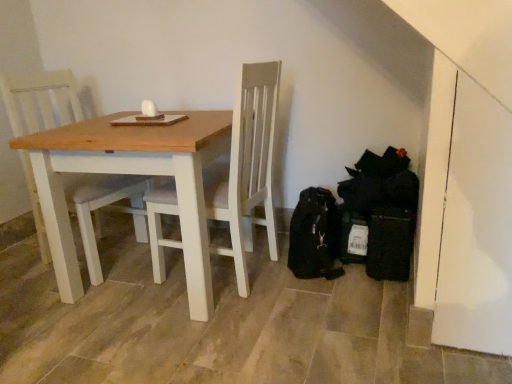
Question: Is wooden table at center located outside white wood chair at center?

Choices:
 (A) no
 (B) yes

Answer: (B)

Question: Is wooden table at center facing away from white wood chair at center?

Choices:
 (A) yes
 (B) no

Answer: (A)

Question: Does wooden table at center have a lesser height compared to white wood chair at center?

Choices:
 (A) yes
 (B) no

Answer: (A)

Question: Is wooden table at center far from white wood chair at center?

Choices:
 (A) yes
 (B) no

Answer: (B)

Question: Can you confirm if wooden table at center is wider than white wood chair at center?

Choices:
 (A) yes
 (B) no

Answer: (A)

Question: Can you confirm if wooden table at center is smaller than white wood chair at center?

Choices:
 (A) no
 (B) yes

Answer: (A)

Question: Does white wood chair at center come behind wooden table at center?

Choices:
 (A) yes
 (B) no

Answer: (A)

Question: Can you confirm if white wood chair at center is positioned to the left of wooden table at center?

Choices:
 (A) yes
 (B) no

Answer: (A)

Question: Considering the relative sizes of white wood chair at center and wooden table at center in the image provided, is white wood chair at center bigger than wooden table at center?

Choices:
 (A) no
 (B) yes

Answer: (A)

Question: Is white wood chair at center wider than wooden table at center?

Choices:
 (A) yes
 (B) no

Answer: (B)

Question: Is white wood chair at center smaller than wooden table at center?

Choices:
 (A) no
 (B) yes

Answer: (B)

Question: Is white wood chair at center directly adjacent to wooden table at center?

Choices:
 (A) no
 (B) yes

Answer: (A)

Question: Would you say wooden table at center is to the left or to the right of white wood chair at center in the picture?

Choices:
 (A) right
 (B) left

Answer: (A)